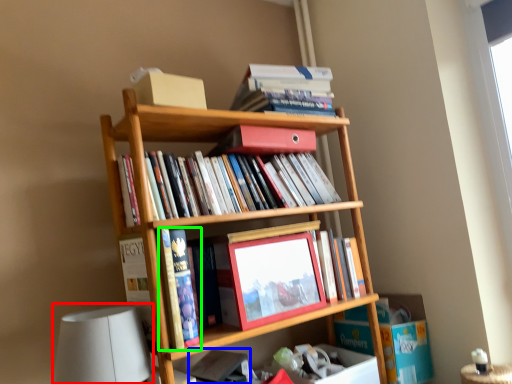
Question: Estimate the real-world distances between objects in this image. Which object is closer to table lamp (highlighted by a red box), book (highlighted by a blue box) or book (highlighted by a green box)?

Choices:
 (A) book
 (B) book

Answer: (B)